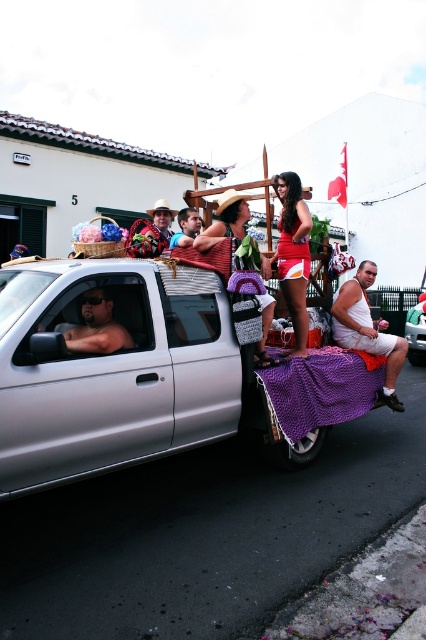
Question: From the image, what is the correct spatial relationship of shiny red shorts at center in relation to matte brown cowboy hat at upper center?

Choices:
 (A) right
 (B) left

Answer: (A)

Question: Is matte brown cowboy hat at upper center behind matte brown hat at upper center?

Choices:
 (A) yes
 (B) no

Answer: (B)

Question: Which object is closer to the camera taking this photo?

Choices:
 (A) knitted sweater at center
 (B) shiny red shorts at center

Answer: (A)

Question: Which point appears farthest from the camera in this image?

Choices:
 (A) (189, 236)
 (B) (305, 280)

Answer: (A)

Question: Is knitted sweater at center thinner than smooth tan skin at center?

Choices:
 (A) no
 (B) yes

Answer: (A)

Question: Based on their relative distances, which object is farther from the matte brown hat at upper center?

Choices:
 (A) purple fabric blanket at rear
 (B) shiny red shorts at center

Answer: (A)